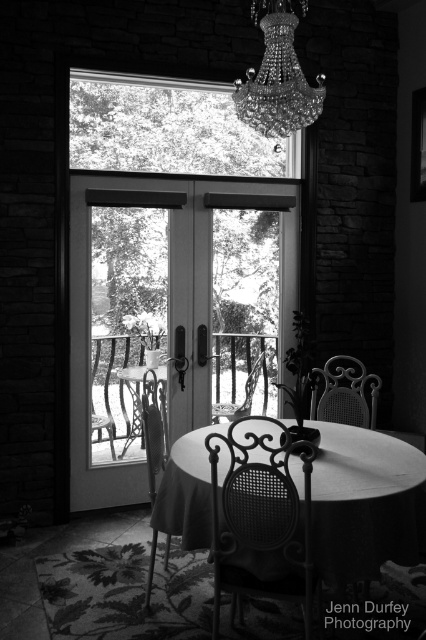
Looking at this image, you are arranging a small plant on the smooth matte black table at center. To ensure it is visible from the woven rattan chair at lower center, where should you place it?

The smooth matte black table at center is below the woven rattan chair at lower center, so placing the plant towards the front edge of the table would make it visible from the chair.

You are a delivery person trying to place a package between the metallic black chair at center and the sparkling crystal chandelier at upper center. The package requires 1.5 meters of space to fit. Is there enough space between them?

The metallic black chair at center is 1.64 meters away from the sparkling crystal chandelier at upper center, so yes, there is enough space to fit the package between them since 1.64 meters is greater than the required 1.5 meters.

You are standing in the room and want to reach a specific point to place a small potted plant. The point is located at coordinates point (331, 422). Considering your height is 5.5 feet, will you be able to comfortably place the plant without needing to bend down or stretch too much?

The distance of point (331, 422) from viewer is 11.82 feet. Since the point is 11.82 feet away, which is within a comfortable reaching distance for someone 5.5 feet tall, you can place the plant without bending or stretching excessively.